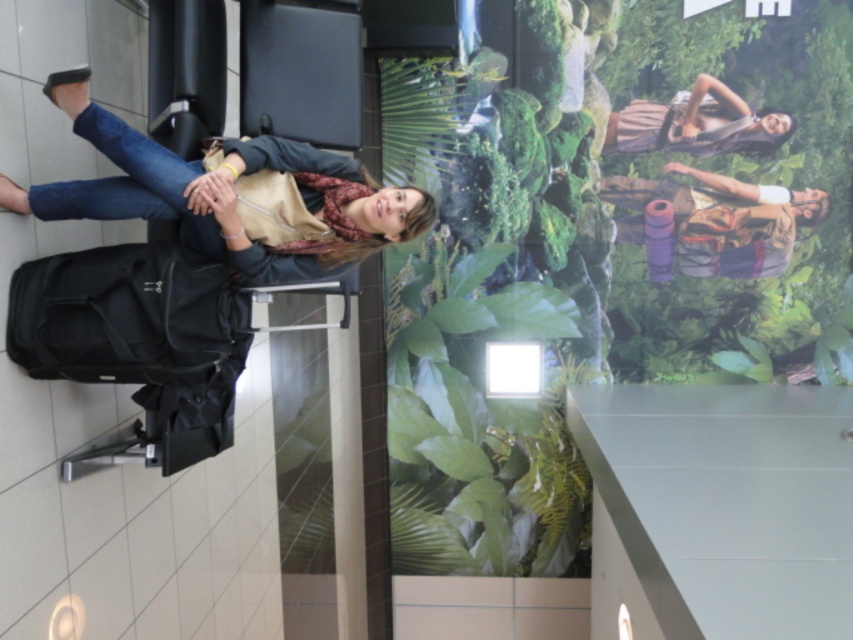
You are standing in the airport and see the woman sitting on a black chair. There is a point marked at coordinates (126, 316). What object is located at that point?

The point at coordinates (126, 316) corresponds to the black fabric suitcase at lower left.

You are a traveler who wants to know which item is taller between the purple fabric backpack at upper right and the brown textured dress at upper right in the rotated image. Can you tell me?

The purple fabric backpack at upper right is much taller than the brown textured dress at upper right according to the description.

You are a photographer trying to capture the black fabric suitcase at lower left and the brown textured dress at upper right in the same frame. Based on their positions, which object would appear closer to the camera in the photo?

The black fabric suitcase at lower left appears closer to the camera because it is in front of the brown textured dress at upper right.